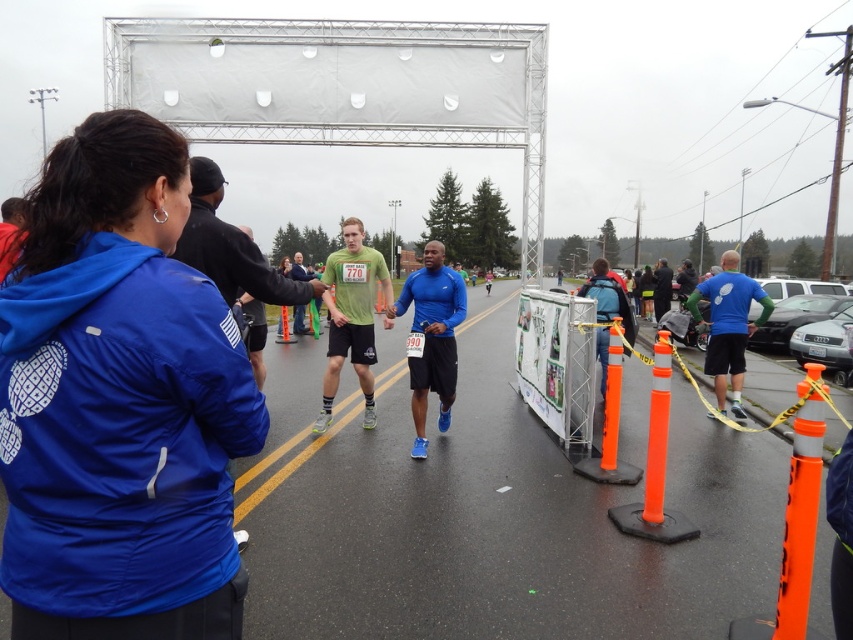
Question: Is blue fabric jacket at upper left closer to the viewer compared to blue matte running shoe at center?

Choices:
 (A) yes
 (B) no

Answer: (A)

Question: Which point is closer to the camera?

Choices:
 (A) blue matte running shoe at center
 (B) blue fabric jacket at upper left

Answer: (B)

Question: Which object is closer to the camera taking this photo?

Choices:
 (A) blue fabric jacket at upper left
 (B) blue matte running shoe at center

Answer: (A)

Question: Is blue fabric jacket at upper left bigger than blue matte running shoe at center?

Choices:
 (A) no
 (B) yes

Answer: (A)

Question: Is blue fabric jacket at upper left above blue matte running shoe at center?

Choices:
 (A) no
 (B) yes

Answer: (B)